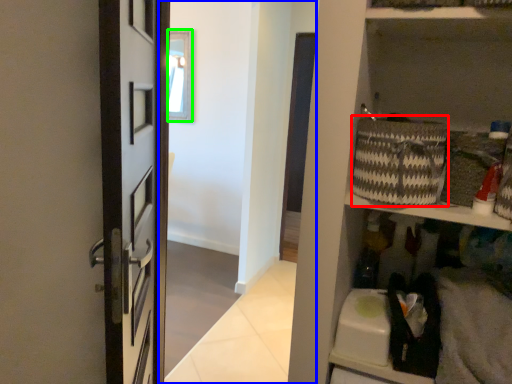
Question: Estimate the real-world distances between objects in this image. Which object is closer to basket (highlighted by a red box), corridor (highlighted by a blue box) or window (highlighted by a green box)?

Choices:
 (A) corridor
 (B) window

Answer: (A)